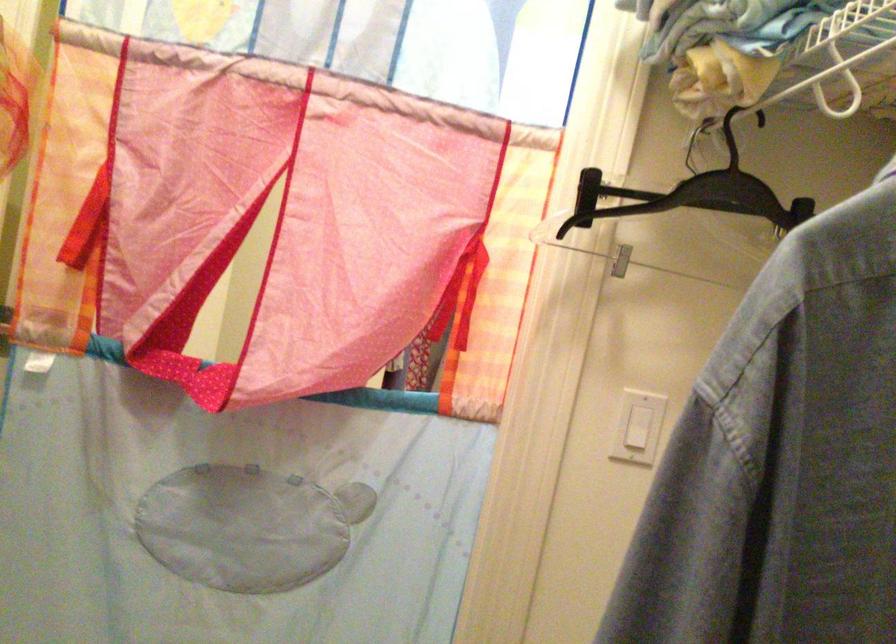
The image size is (896, 644). Describe the element at coordinates (418, 365) in the screenshot. I see `a red dotted tie` at that location.